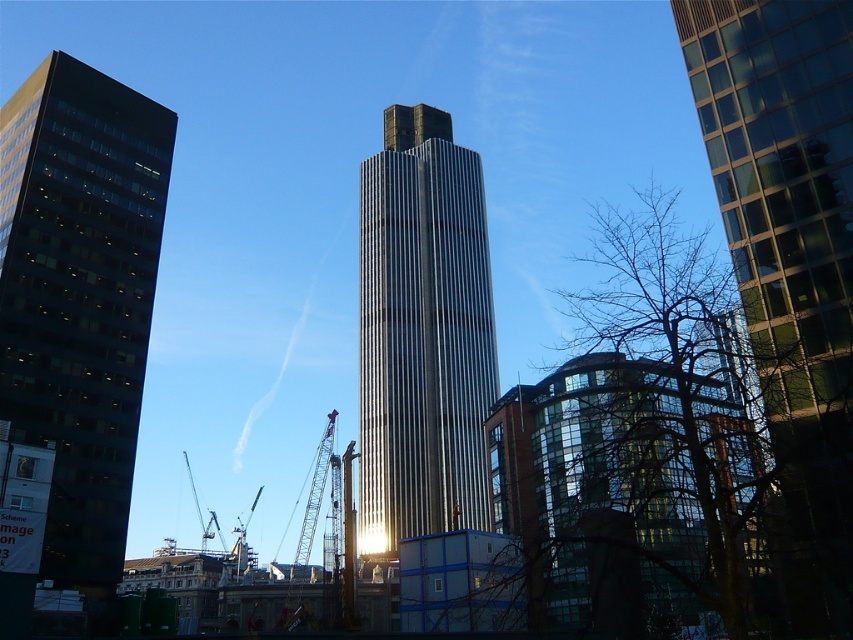
Question: Based on their relative distances, which object is farther from the metallic silver tower at center?

Choices:
 (A) metallic gray crane at center
 (B) matte glass skyscraper at left

Answer: (B)

Question: Is matte glass skyscraper at left to the left of metallic gray crane at center from the viewer's perspective?

Choices:
 (A) no
 (B) yes

Answer: (B)

Question: Which of the following is the farthest from the observer?

Choices:
 (A) (115, 540)
 (B) (480, 198)
 (C) (766, 264)

Answer: (B)

Question: Which object appears farthest from the camera in this image?

Choices:
 (A) metallic gray crane at center
 (B) matte glass skyscraper at left
 (C) glassy reflective skyscraper at center

Answer: (A)

Question: Is metallic silver tower at center above metallic gray crane at center?

Choices:
 (A) yes
 (B) no

Answer: (A)

Question: Does matte glass skyscraper at left appear on the right side of metallic gray crane at center?

Choices:
 (A) yes
 (B) no

Answer: (B)